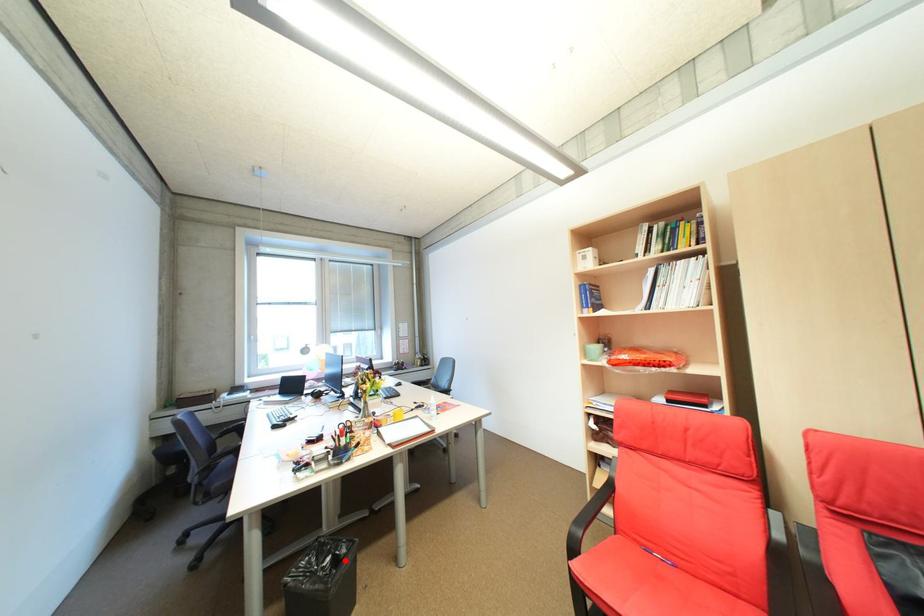
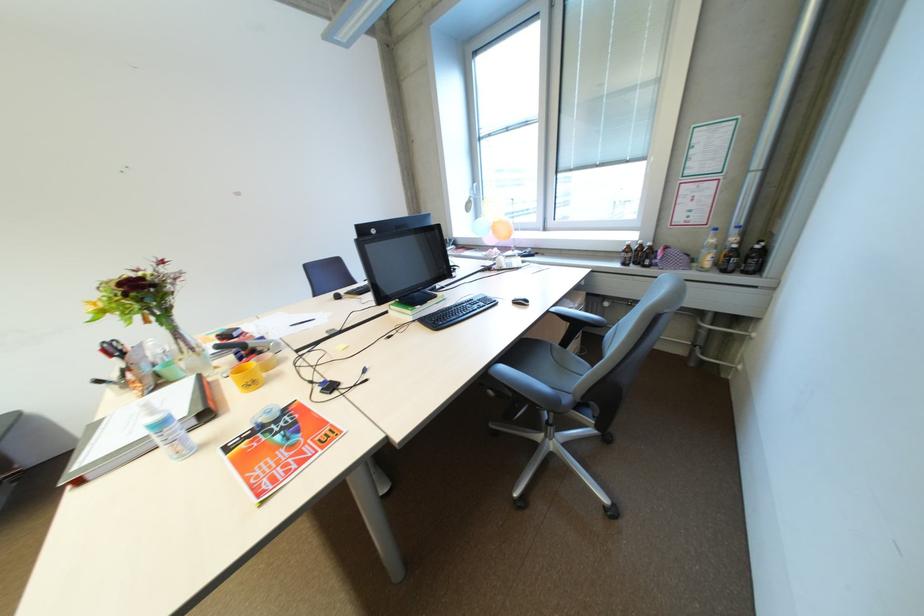
Question: I am providing you with two images of the same scene from different viewpoints. A red point is marked on the first image. Can you still see the location of the red point in image 2?

Choices:
 (A) Yes
 (B) No

Answer: (B)